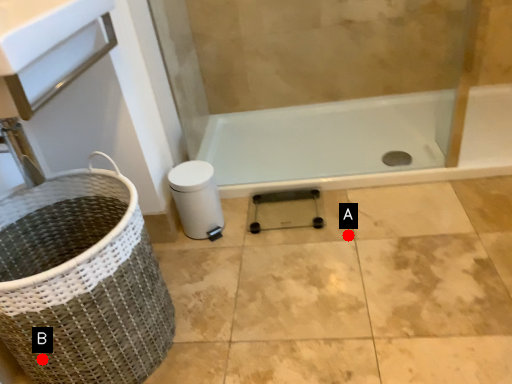
Question: Two points are circled on the image, labeled by A and B beside each circle. Which point is closer to the camera?

Choices:
 (A) A is closer
 (B) B is closer

Answer: (B)